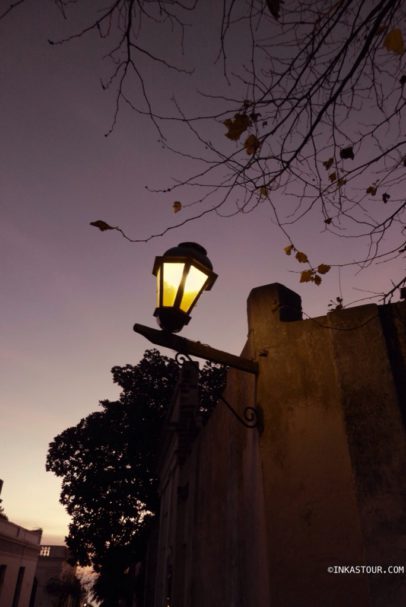
Identify the location of lamp. tap(184, 249).